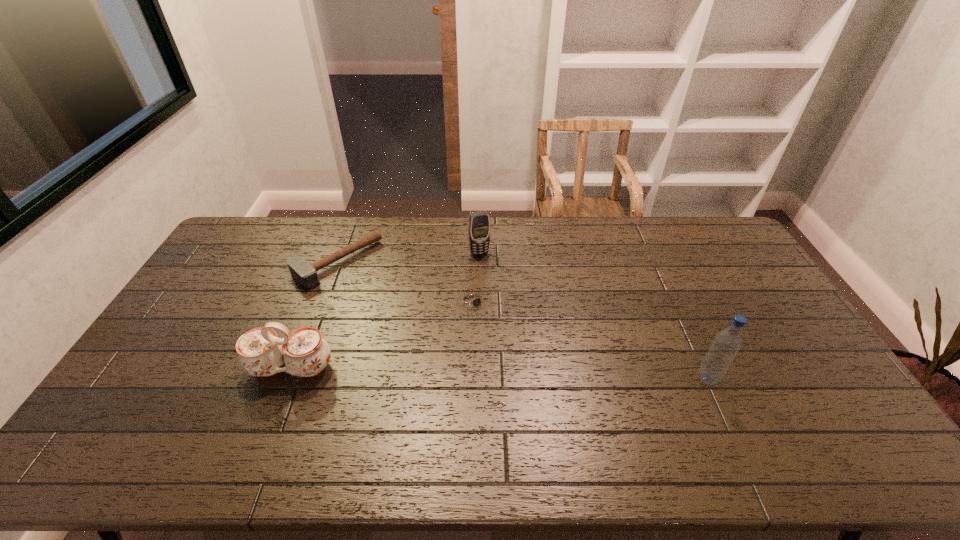
The image size is (960, 540). I want to click on vacant space on the desktop that is between the chinaware and the water bottle and is positioned on the face of the shortest object, so click(528, 374).

Image resolution: width=960 pixels, height=540 pixels. Find the location of `free space on the desktop that is between the chinaware and the rightmost object and is positioned on the striking surface of the hammer`. free space on the desktop that is between the chinaware and the rightmost object and is positioned on the striking surface of the hammer is located at coordinates (467, 373).

Where is `free spot on the desktop that is between the chinaware and the tallest object and is positioned on the front face of the cellular telephone`? The height and width of the screenshot is (540, 960). free spot on the desktop that is between the chinaware and the tallest object and is positioned on the front face of the cellular telephone is located at coordinates (537, 374).